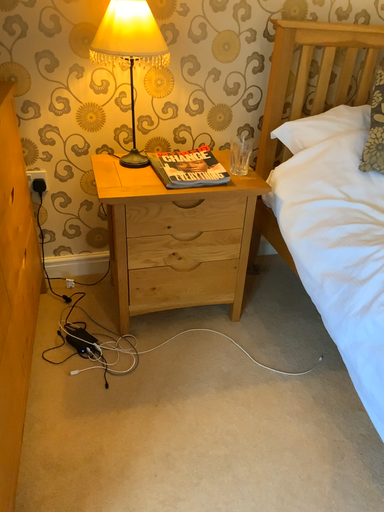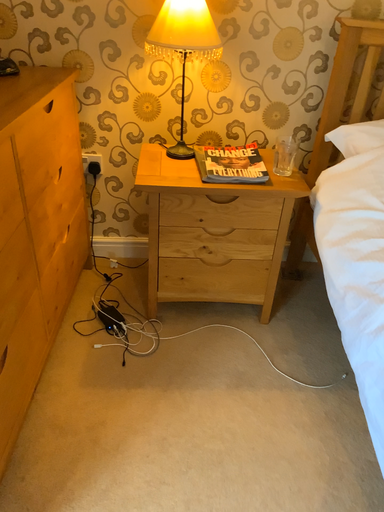
Question: How did the camera likely rotate when shooting the video?

Choices:
 (A) rotated right
 (B) rotated left

Answer: (B)